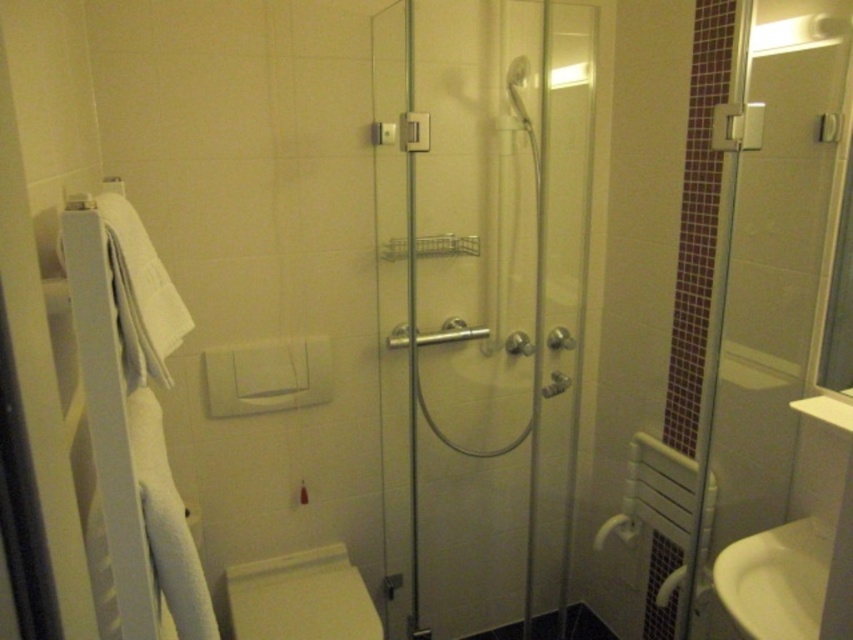
You are a cleaning robot with a circular base of radius 0.2 meters. You need to move from the center of the bathroom to the white plastic towel rack at left without touching any walls or obstacles. Is there enough space for you to maneuver safely?

The white plastic towel rack at left is located at point (44, 241). Since the robot has a radius of 0.2 meters, it needs at least 0.4 meters of clearance from walls and obstacles. The coordinates indicate the towel rack is positioned near the edge of the bathroom, so there might not be sufficient space for the robot to maneuver safely without touching walls or the rack itself. However, without knowing the exact bathroom dimensions, it is difficult to confirm. Please provide more information about theroom

You are standing in the bathroom and want to place a small plant between the two points, point (456, 198) and point (752, 305). Which point should the plant be closer to in order to be closer to the viewer?

The plant should be closer to point (456, 198) because it is closer to the viewer than point (752, 305).

You are a bathroom designer planning to install a new toilet. You have a space that can accommodate the transparent glass shower door at center. Can the white glossy toilet bowl at lower center fit in the same space?

The transparent glass shower door at center is wider than the white glossy toilet bowl at lower center. Since the space can accommodate the shower door, the toilet bowl, being narrower, should also fit in the same space.